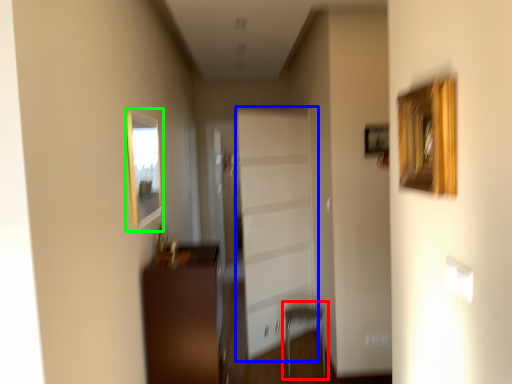
Question: Estimate the real-world distances between objects in this image. Which object is closer to armchair (highlighted by a red box), garage door (highlighted by a blue box) or picture frame (highlighted by a green box)?

Choices:
 (A) garage door
 (B) picture frame

Answer: (A)